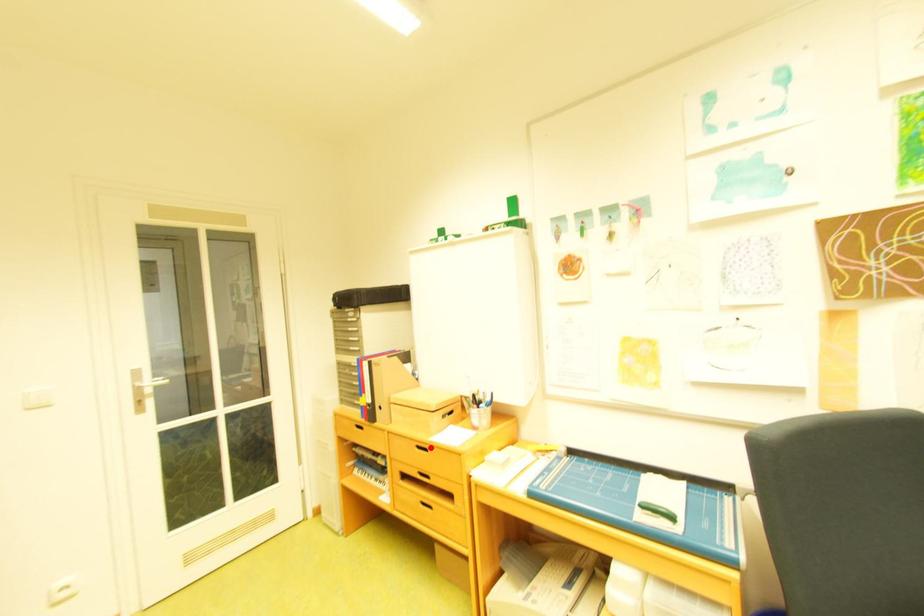
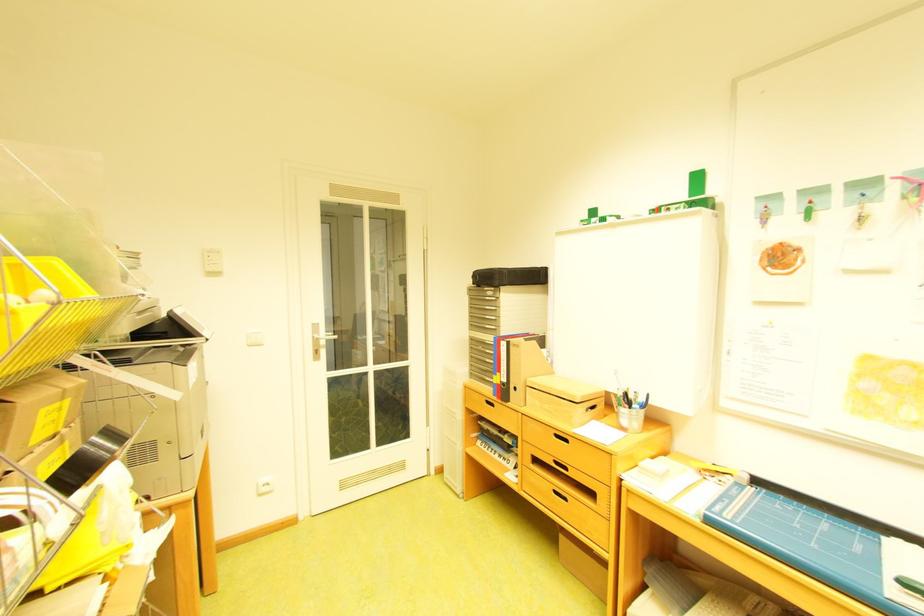
Locate, in the second image, the point that corresponds to the highlighted location in the first image.

(568, 437)